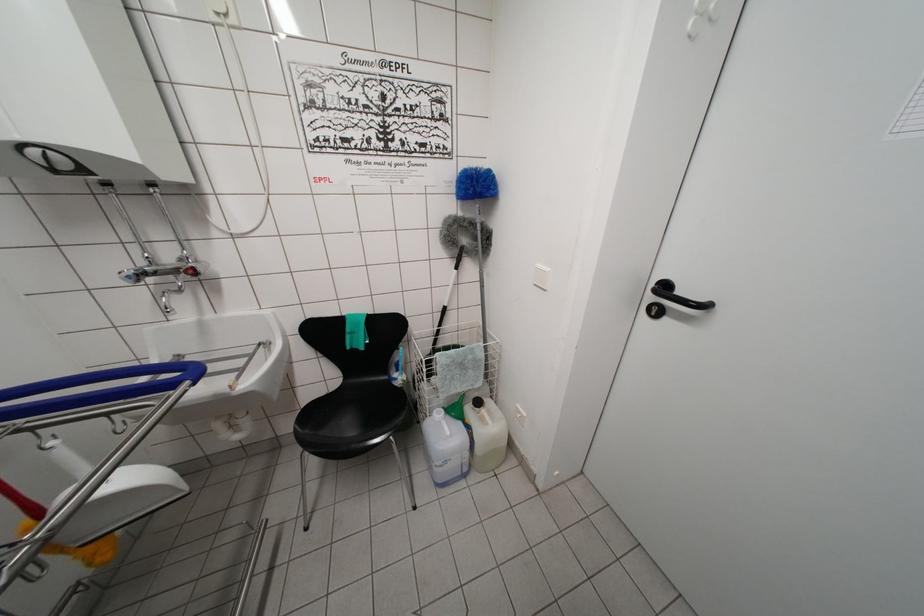
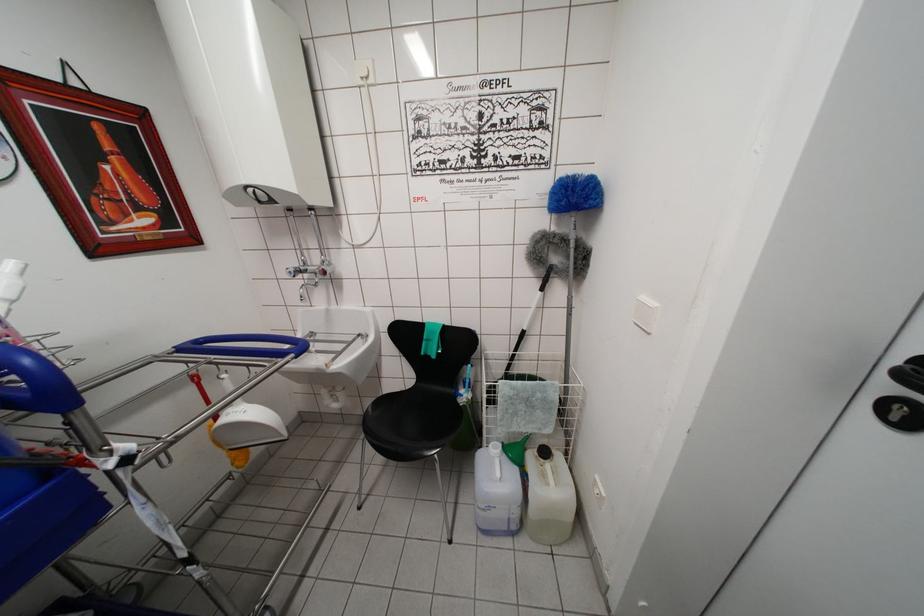
Where in the second image is the point corresponding to point 489,403 from the first image?

(561, 455)